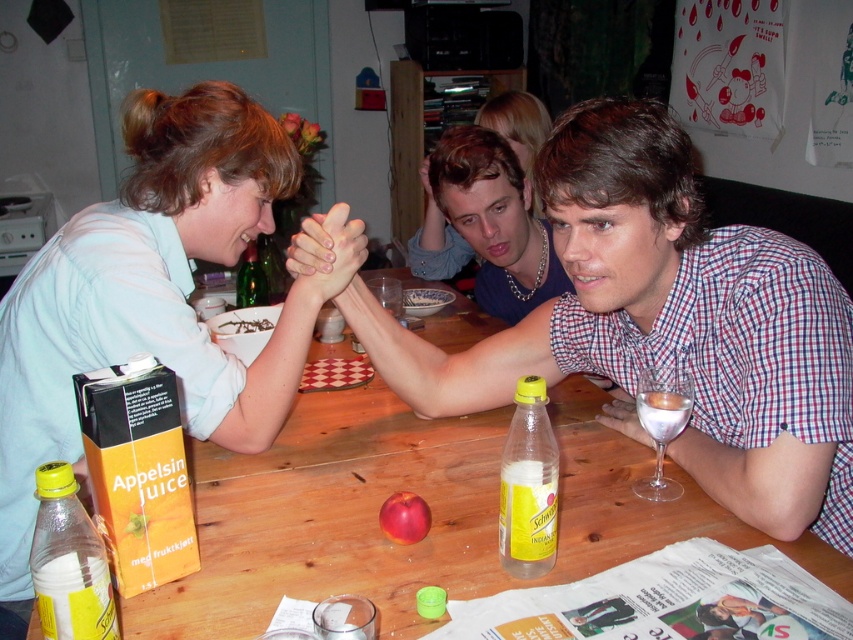
Is point (444, 246) positioned before point (263, 275)?

No, (444, 246) is behind (263, 275).

Identify the location of shiny blue shirt at center. (436, 237).

Is point (189, 604) positioned after point (90, 566)?

Yes, it is behind point (90, 566).

Can you confirm if wooden table at center is positioned to the right of yellow matte bottle at lower left?

Correct, you'll find wooden table at center to the right of yellow matte bottle at lower left.

Describe the element at coordinates (428, 506) in the screenshot. I see `wooden table at center` at that location.

What are the coordinates of `wooden table at center` in the screenshot? It's located at (428, 506).

Who is lower down, green glass bottle at upper left or translucent glass at lower right?

translucent glass at lower right is below.

Can you confirm if green glass bottle at upper left is wider than translucent glass at lower right?

Yes, green glass bottle at upper left is wider than translucent glass at lower right.

This screenshot has width=853, height=640. I want to click on green glass bottle at upper left, so click(x=251, y=280).

Identify the location of green glass bottle at upper left. (251, 280).